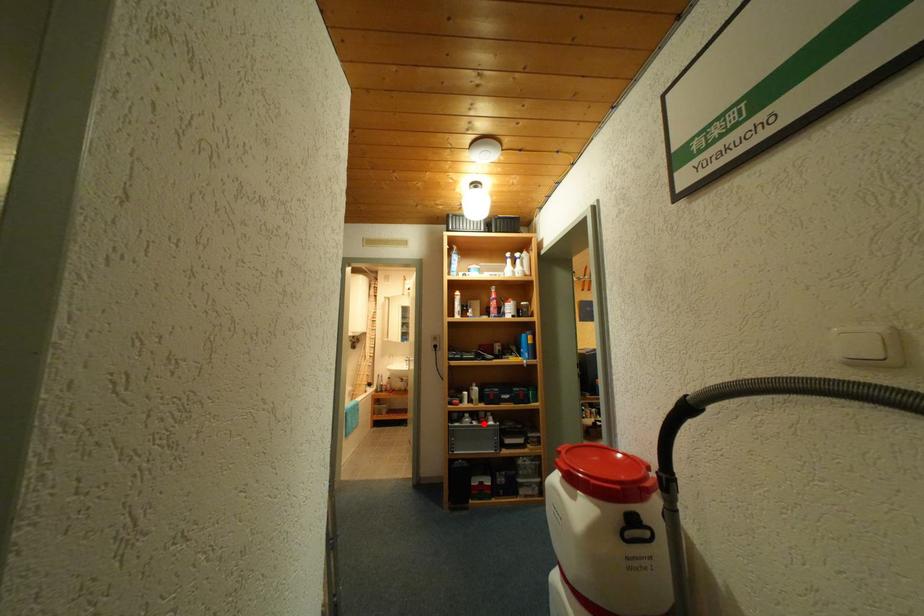
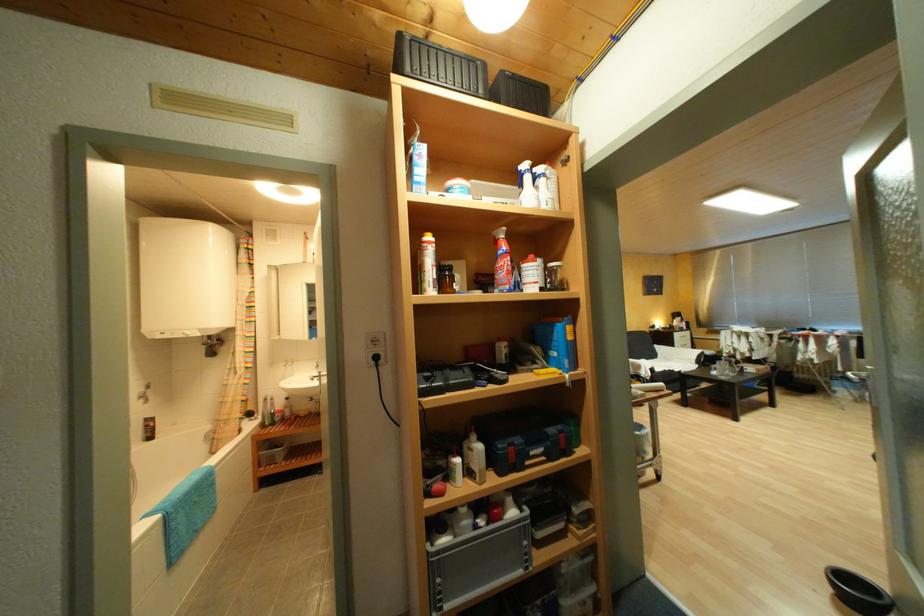
Find the pixel in the second image that matches the highlighted location in the first image.

(491, 523)